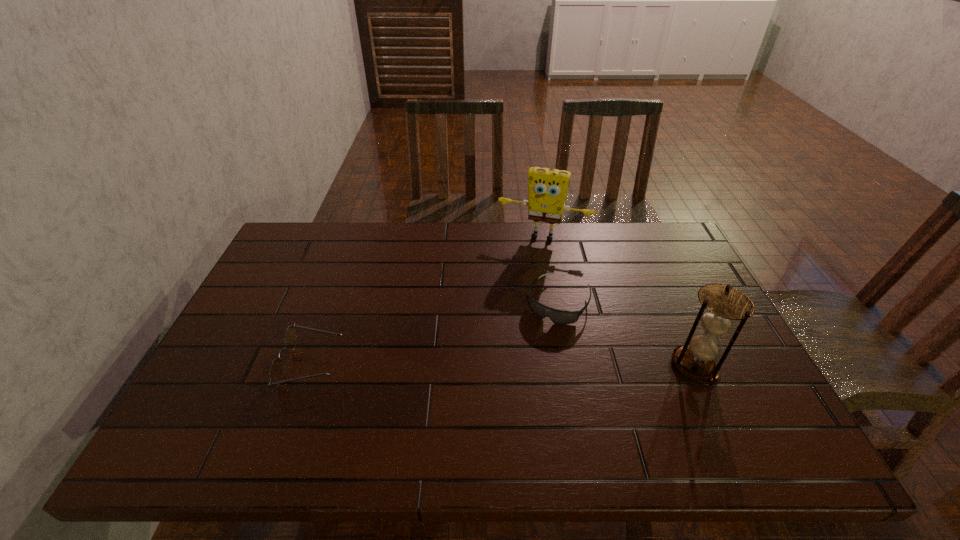
Where is `vacant space at the left edge of the desktop`? The image size is (960, 540). vacant space at the left edge of the desktop is located at coordinates (281, 309).

This screenshot has height=540, width=960. In order to click on blank area at the right edge in this screenshot , I will do `click(682, 319)`.

Find the location of a particular element. The height and width of the screenshot is (540, 960). vacant space at the far left corner of the desktop is located at coordinates (297, 227).

Identify the location of free space at the far right corner of the desktop. (628, 229).

The width and height of the screenshot is (960, 540). Identify the location of vacant space at the near right corner. (732, 393).

Where is `blank region between the sponge and the leftmost object`? Image resolution: width=960 pixels, height=540 pixels. blank region between the sponge and the leftmost object is located at coordinates (427, 300).

I want to click on free area in between the third nearest object and the rightmost object, so click(626, 334).

Locate an element on the screen. This screenshot has width=960, height=540. free spot between the rightmost object and the farthest object is located at coordinates (619, 301).

Locate an element on the screen. The height and width of the screenshot is (540, 960). vacant space in between the farthest object and the spectacles is located at coordinates (427, 300).

The height and width of the screenshot is (540, 960). What are the coordinates of `vacant area between the third nearest object and the spectacles` in the screenshot? It's located at (435, 333).